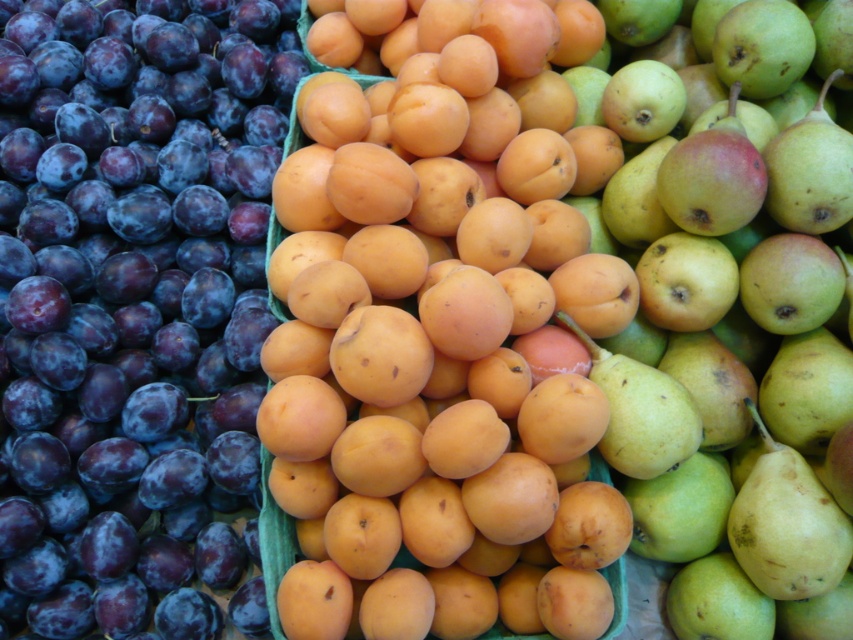
Looking at this image, what is the object located at the coordinates point (439,352)?

The object located at point (439,352) is an orange matte apricot at center.

You are a customer at a fruit market holding a basket that can only hold fruits within 90 centimeters of your position. You see the orange matte apricot at center. Can you reach it with your basket?

The orange matte apricot at center is 88.43 centimeters away from the camera, so yes, you can reach it with your basket since it is within the 90 centimeter limit.

You are a customer at the fruit market and want to pick up the orange matte apricot at center and the green matte pear at center. Which fruit do you need to reach further into the display to get?

The green matte pear at center requires reaching further into the display because it is farther from the viewer compared to the orange matte apricot at center.